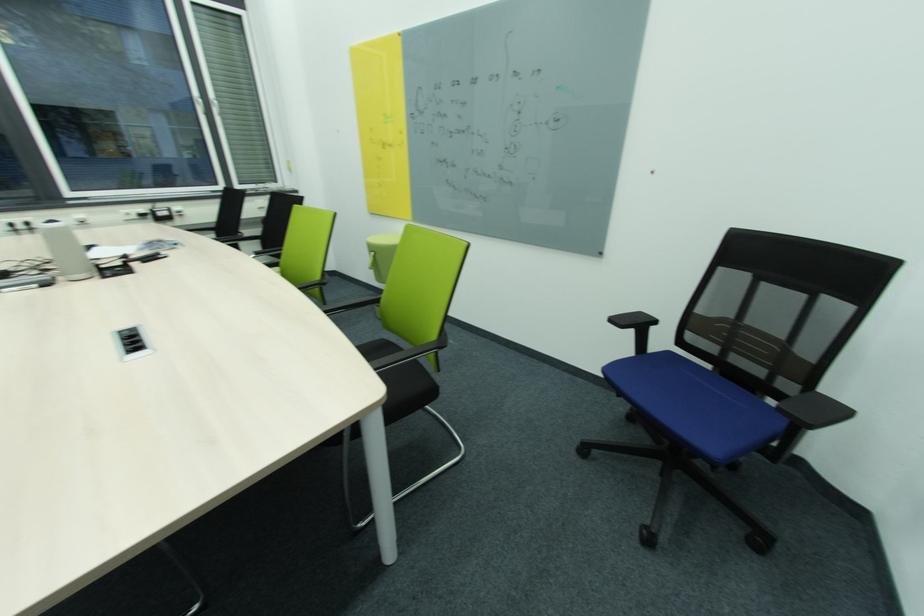
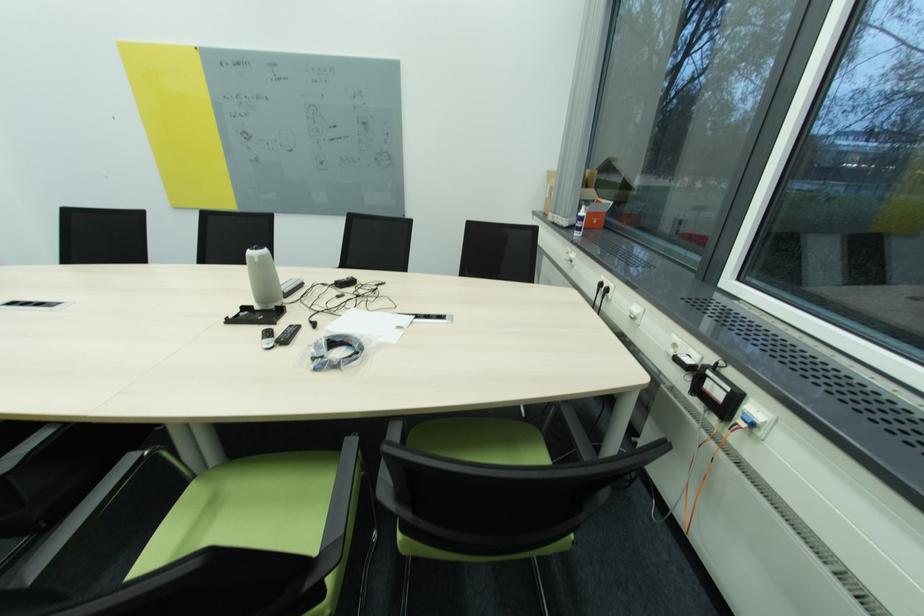
Locate, in the second image, the point that corresponds to point (31, 225) in the first image.

(612, 291)